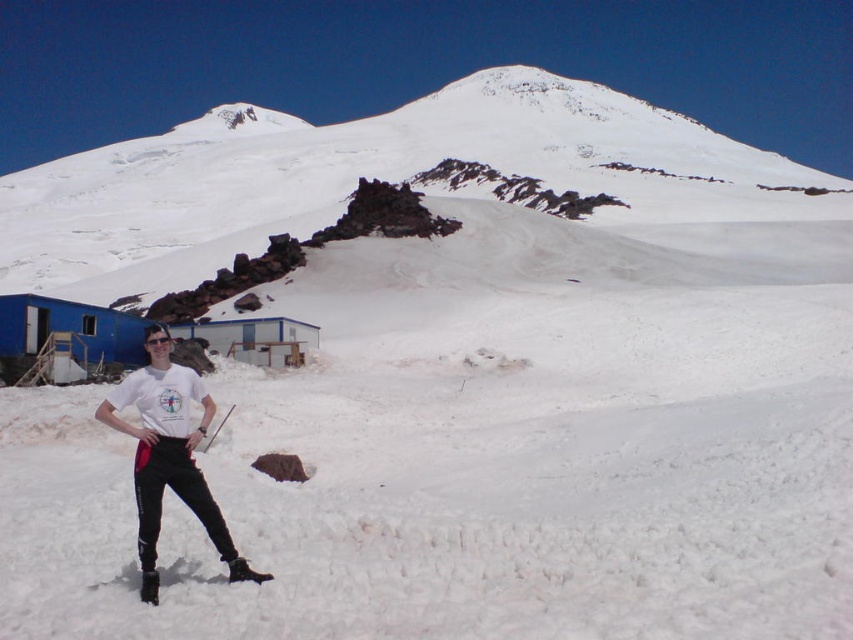
You are standing at the point with coordinates point (x=119, y=419) and want to walk towards the mountain peak. Is the point point (x=149, y=289) located behind you in the direction you are facing?

Point (x=149, y=289) is behind point (x=119, y=419), so yes, the point point (x=149, y=289) is located behind you in the direction you are facing.